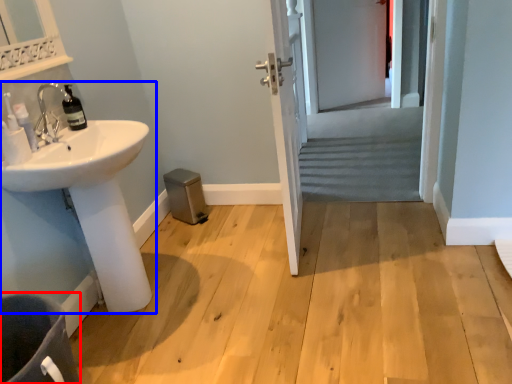
Question: Which of the following is the farthest to the observer, toilet bowl (highlighted by a red box) or sink (highlighted by a blue box)?

Choices:
 (A) toilet bowl
 (B) sink

Answer: (B)